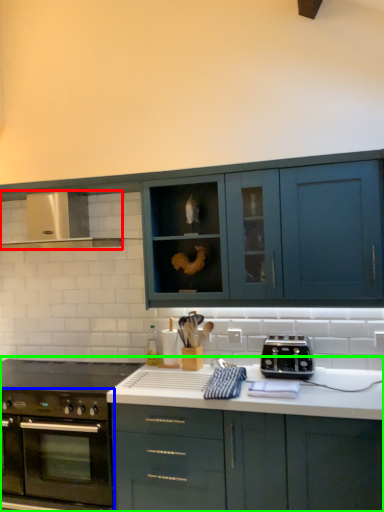
Question: Considering the real-world distances, which object is closest to exhaust hood (highlighted by a red box)? oven (highlighted by a blue box) or cabinetry (highlighted by a green box).

Choices:
 (A) oven
 (B) cabinetry

Answer: (A)